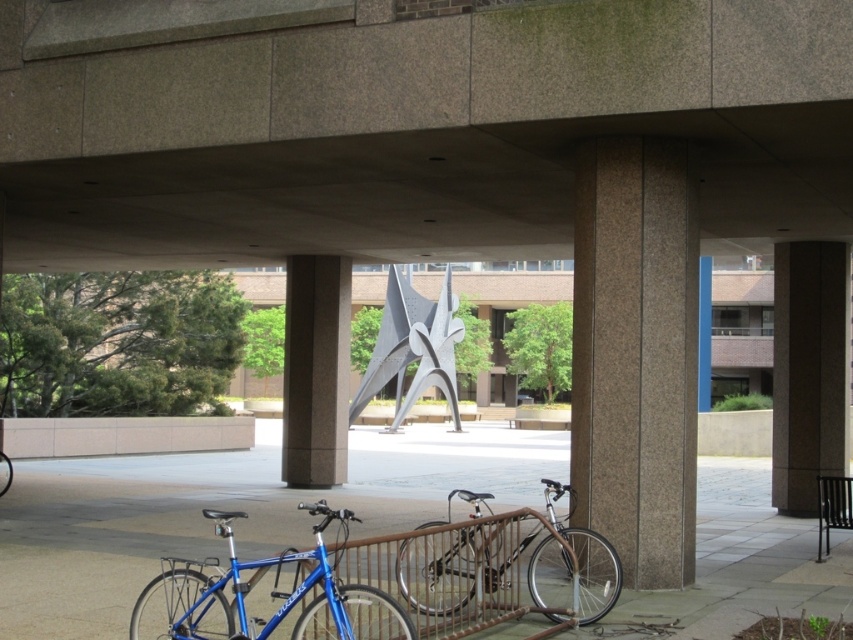
Between point (358, 515) and point (328, 486), which one is positioned behind?

The point (328, 486) is behind.

Image resolution: width=853 pixels, height=640 pixels. What are the coordinates of `gray concrete pavement at center` in the screenshot? It's located at (225, 508).

Can you confirm if matte blue bicycle at lower left is positioned to the right of silver metallic bicycle at center?

No, matte blue bicycle at lower left is not to the right of silver metallic bicycle at center.

Can you confirm if matte blue bicycle at lower left is positioned to the left of silver metallic bicycle at center?

Correct, you'll find matte blue bicycle at lower left to the left of silver metallic bicycle at center.

This screenshot has height=640, width=853. What are the coordinates of `matte blue bicycle at lower left` in the screenshot? It's located at (270, 593).

Is smooth concrete pillar at center positioned in front of gray concrete pillar at center?

Yes.

Is smooth concrete pillar at center shorter than gray concrete pillar at center?

No, smooth concrete pillar at center is not shorter than gray concrete pillar at center.

Locate an element on the screen. smooth concrete pillar at center is located at coordinates (636, 355).